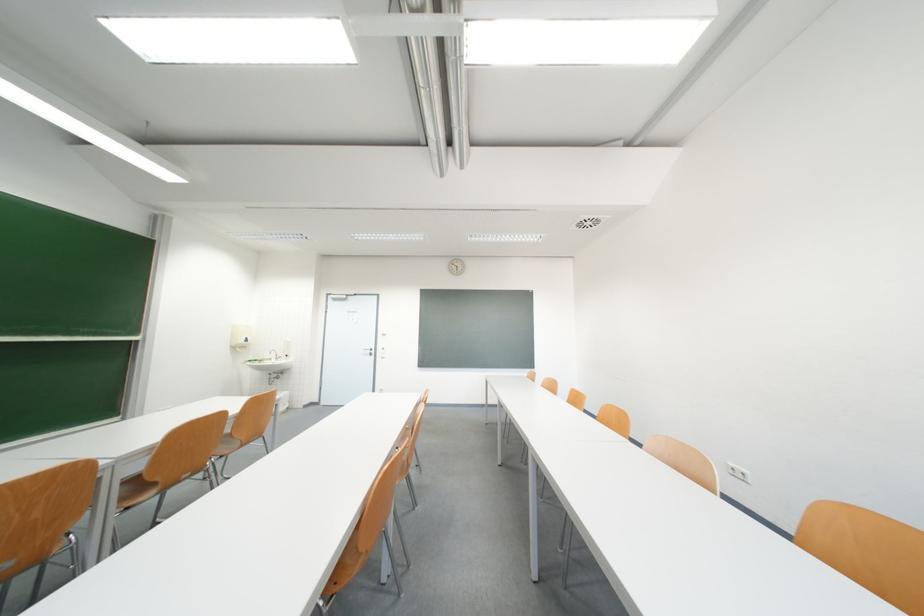
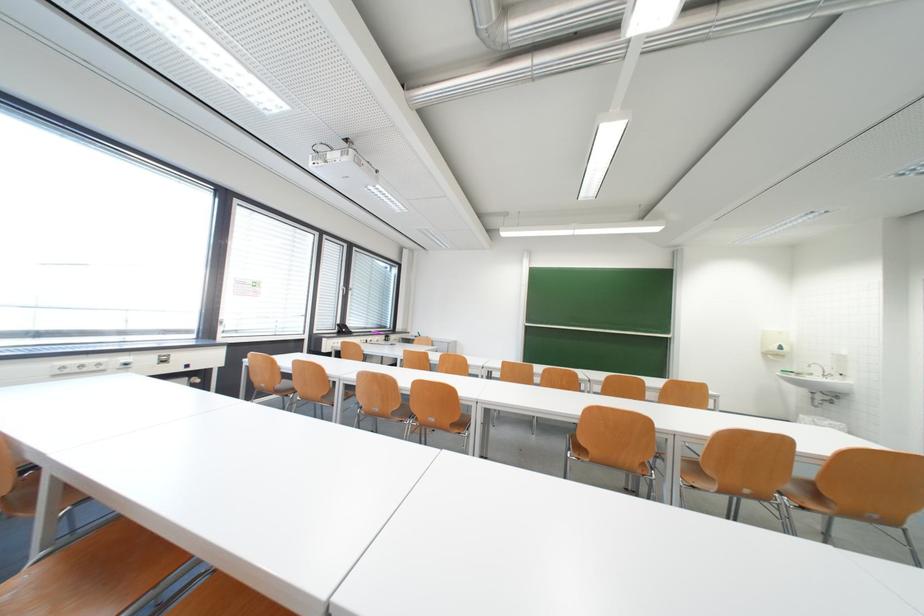
In the second image, find the point that corresponds to (x=248, y=349) in the first image.

(784, 357)